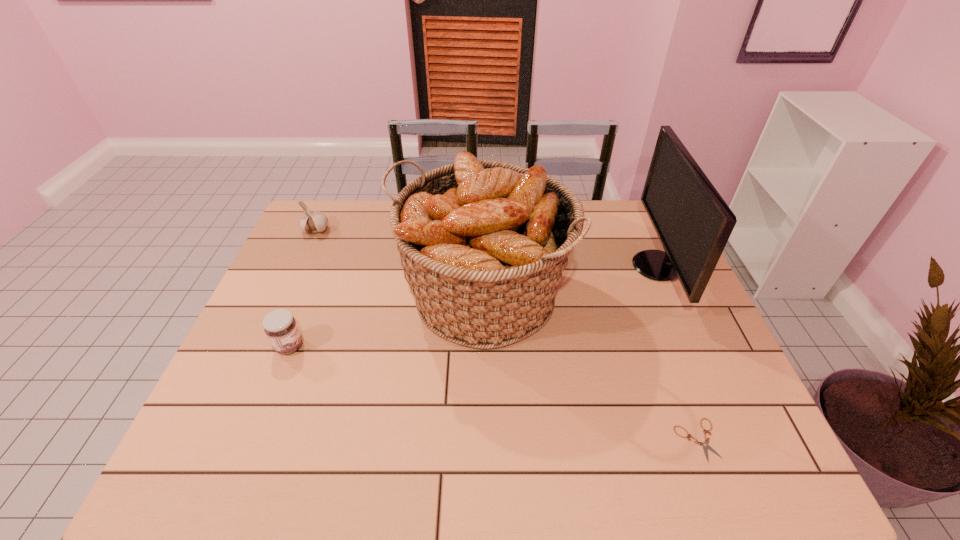
Locate an element on the screen. basket is located at coordinates (483, 244).

Where is `computer monitor`? The height and width of the screenshot is (540, 960). computer monitor is located at coordinates (693, 223).

Identify the location of garlic. click(x=312, y=222).

At what (x,y) coordinates should I click in order to perform the action: click on jam. Please return your answer as a coordinate pair (x, y). The image size is (960, 540). Looking at the image, I should click on (280, 326).

Image resolution: width=960 pixels, height=540 pixels. I want to click on the nearest object, so click(705, 445).

Find the location of a particular element. This screenshot has width=960, height=540. the shortest object is located at coordinates (705, 445).

Identify the location of free spot located 0.070m on the front of the third object from right to left. (483, 392).

Where is `free spot located 0.070m on the front-facing side of the computer monitor`? This screenshot has height=540, width=960. free spot located 0.070m on the front-facing side of the computer monitor is located at coordinates (610, 266).

The height and width of the screenshot is (540, 960). I want to click on vacant space situated 0.290m on the front-facing side of the computer monitor, so click(x=539, y=266).

Locate an element on the screen. The width and height of the screenshot is (960, 540). free space located on the front-facing side of the computer monitor is located at coordinates (529, 266).